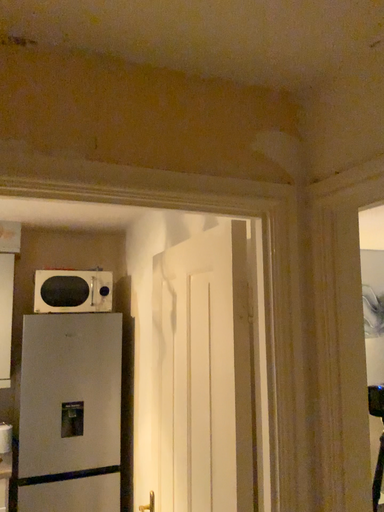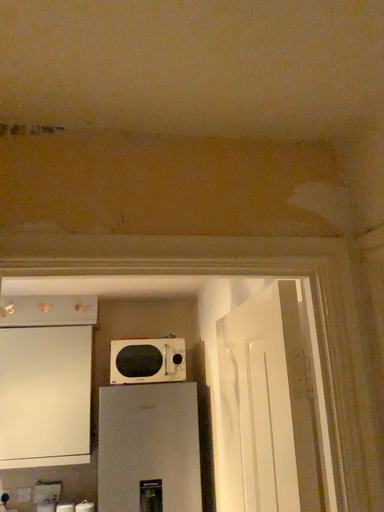
Question: How did the camera likely rotate when shooting the video?

Choices:
 (A) rotated upward
 (B) rotated downward

Answer: (A)